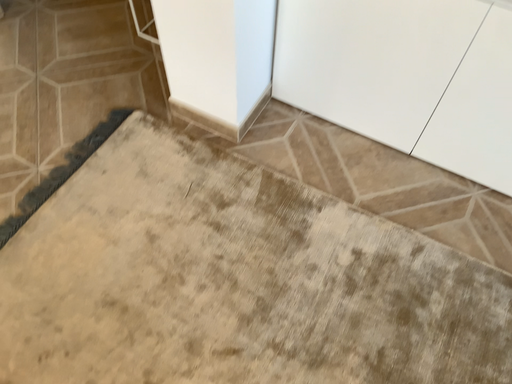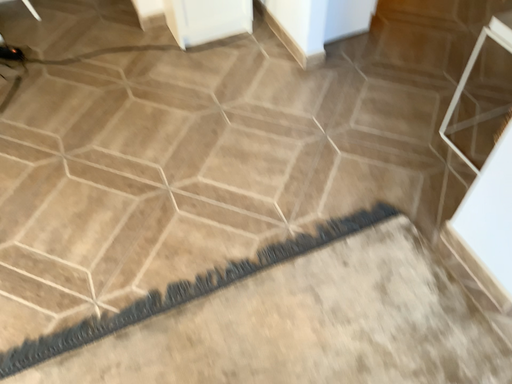
Question: Which way did the camera rotate in the video?

Choices:
 (A) rotated upward
 (B) rotated downward

Answer: (A)